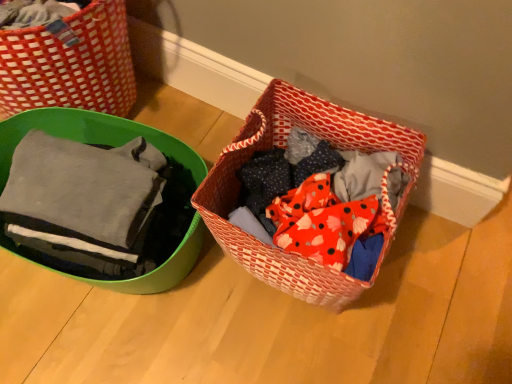
Consider the image. Measure the distance between matte gray fabric at left and camera.

matte gray fabric at left is 84.60 centimeters from camera.

What are the coordinates of `matte green bowl at left, marked as the second picnic basket in a right-to-left arrangement` in the screenshot? It's located at (70, 64).

Find the location of a particular element. matte gray fabric at left is located at coordinates (91, 135).

Which object is thinner, red woven basket at center, the second picnic basket positioned from the left, or matte gray fabric at left?

With smaller width is matte gray fabric at left.

Does red woven basket at center, the 1th picnic basket in the right-to-left sequence, have a greater height compared to matte gray fabric at left?

Yes, red woven basket at center, the 1th picnic basket in the right-to-left sequence, is taller than matte gray fabric at left.

Is matte green bowl at left, marked as the second picnic basket in a right-to-left arrangement, bigger than matte gray fabric at left?

Yes, matte green bowl at left, marked as the second picnic basket in a right-to-left arrangement, is bigger than matte gray fabric at left.

Would you say matte green bowl at left, marked as the second picnic basket in a right-to-left arrangement, is outside matte gray fabric at left?

Yes.

Looking at this image, from the image's perspective, is matte green bowl at left, arranged as the 1th picnic basket when viewed from the left, on matte gray fabric at left?

Yes, from the image's perspective, matte green bowl at left, arranged as the 1th picnic basket when viewed from the left, is over matte gray fabric at left.

Is point (94, 16) closer to camera compared to point (166, 280)?

Yes, it is in front of point (166, 280).

Is red woven basket at center, the second picnic basket positioned from the left, to the right of matte green bowl at left, marked as the second picnic basket in a right-to-left arrangement, from the viewer's perspective?

Indeed, red woven basket at center, the second picnic basket positioned from the left, is positioned on the right side of matte green bowl at left, marked as the second picnic basket in a right-to-left arrangement.

From a real-world perspective, between red woven basket at center, the second picnic basket positioned from the left, and matte green bowl at left, arranged as the 1th picnic basket when viewed from the left, who is vertically higher?

matte green bowl at left, arranged as the 1th picnic basket when viewed from the left.

Is red woven basket at center, the second picnic basket positioned from the left, not inside matte green bowl at left, arranged as the 1th picnic basket when viewed from the left?

Yes.

Which object is further away from the camera taking this photo, red woven basket at center, the 1th picnic basket in the right-to-left sequence, or matte green bowl at left, marked as the second picnic basket in a right-to-left arrangement?

matte green bowl at left, marked as the second picnic basket in a right-to-left arrangement, is further away from the camera.

Is matte gray fabric at left facing towards red woven basket at center, the 1th picnic basket in the right-to-left sequence?

No, matte gray fabric at left is not oriented towards red woven basket at center, the 1th picnic basket in the right-to-left sequence.

Based on the photo, which of these two, matte gray fabric at left or red woven basket at center, the second picnic basket positioned from the left, is bigger?

With larger size is red woven basket at center, the second picnic basket positioned from the left.

Is point (11, 131) behind point (322, 293)?

Yes, point (11, 131) is behind point (322, 293).

In the scene shown: Could you tell me if matte gray fabric at left is facing matte green bowl at left, marked as the second picnic basket in a right-to-left arrangement?

No, matte gray fabric at left is not oriented towards matte green bowl at left, marked as the second picnic basket in a right-to-left arrangement.

Is point (10, 148) positioned after point (117, 6)?

No, (10, 148) is closer to viewer.

Would you say matte gray fabric at left is to the left or to the right of matte green bowl at left, arranged as the 1th picnic basket when viewed from the left, in the picture?

Based on their positions, matte gray fabric at left is located to the right of matte green bowl at left, arranged as the 1th picnic basket when viewed from the left.

Is the position of matte gray fabric at left more distant than that of matte green bowl at left, marked as the second picnic basket in a right-to-left arrangement?

No, matte gray fabric at left is closer to the camera.

Is point (40, 67) farther from viewer compared to point (317, 287)?

Yes.

The width and height of the screenshot is (512, 384). What are the coordinates of `picnic basket below the matte green bowl at left, marked as the second picnic basket in a right-to-left arrangement (from a real-world perspective)` in the screenshot? It's located at (281, 146).

How many degrees apart are the facing directions of matte green bowl at left, arranged as the 1th picnic basket when viewed from the left, and red woven basket at center, the 1th picnic basket in the right-to-left sequence?

The angular difference between matte green bowl at left, arranged as the 1th picnic basket when viewed from the left, and red woven basket at center, the 1th picnic basket in the right-to-left sequence, is 1.84 degrees.

From a real-world perspective, between matte green bowl at left, arranged as the 1th picnic basket when viewed from the left, and red woven basket at center, the 1th picnic basket in the right-to-left sequence, who is vertically lower?

From a 3D spatial view, red woven basket at center, the 1th picnic basket in the right-to-left sequence, is below.

This screenshot has height=384, width=512. Find the location of `the 2nd picnic basket below the matte gray fabric at left (from a real-world perspective)`. the 2nd picnic basket below the matte gray fabric at left (from a real-world perspective) is located at coordinates (281, 146).

The height and width of the screenshot is (384, 512). I want to click on gift basket below the matte green bowl at left, marked as the second picnic basket in a right-to-left arrangement (from the image's perspective), so click(x=91, y=135).

Considering their positions, is red woven basket at center, the 1th picnic basket in the right-to-left sequence, positioned further to matte green bowl at left, marked as the second picnic basket in a right-to-left arrangement, than matte gray fabric at left?

Among the two, red woven basket at center, the 1th picnic basket in the right-to-left sequence, is located further to matte green bowl at left, marked as the second picnic basket in a right-to-left arrangement.

From the image, which object appears to be nearer to red woven basket at center, the 1th picnic basket in the right-to-left sequence, matte gray fabric at left or matte green bowl at left, arranged as the 1th picnic basket when viewed from the left?

matte gray fabric at left.

From the image, which object appears to be nearer to matte gray fabric at left, matte green bowl at left, arranged as the 1th picnic basket when viewed from the left, or red woven basket at center, the second picnic basket positioned from the left?

matte green bowl at left, arranged as the 1th picnic basket when viewed from the left, is positioned closer to the anchor matte gray fabric at left.

When comparing their distances from matte gray fabric at left, does red woven basket at center, the second picnic basket positioned from the left, or matte green bowl at left, marked as the second picnic basket in a right-to-left arrangement, seem further?

Based on the image, red woven basket at center, the second picnic basket positioned from the left, appears to be further to matte gray fabric at left.

Which object lies further to the anchor point matte green bowl at left, marked as the second picnic basket in a right-to-left arrangement, matte gray fabric at left or red woven basket at center, the second picnic basket positioned from the left?

Based on the image, red woven basket at center, the second picnic basket positioned from the left, appears to be further to matte green bowl at left, marked as the second picnic basket in a right-to-left arrangement.

Which object lies further to the anchor point red woven basket at center, the 1th picnic basket in the right-to-left sequence, matte green bowl at left, arranged as the 1th picnic basket when viewed from the left, or matte gray fabric at left?

Based on the image, matte green bowl at left, arranged as the 1th picnic basket when viewed from the left, appears to be further to red woven basket at center, the 1th picnic basket in the right-to-left sequence.

Find the location of a particular element. The width and height of the screenshot is (512, 384). gift basket between matte green bowl at left, arranged as the 1th picnic basket when viewed from the left, and red woven basket at center, the second picnic basket positioned from the left is located at coordinates (91, 135).